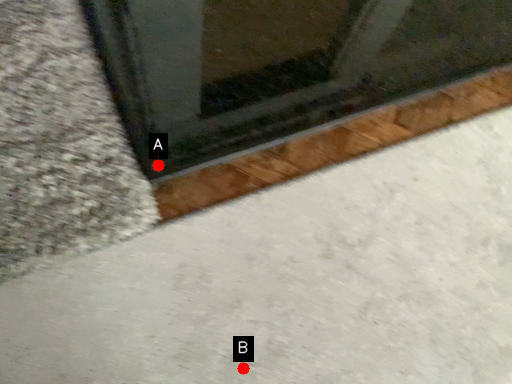
Question: Two points are circled on the image, labeled by A and B beside each circle. Among these points, which one is farthest from the camera?

Choices:
 (A) A is further
 (B) B is further

Answer: (A)